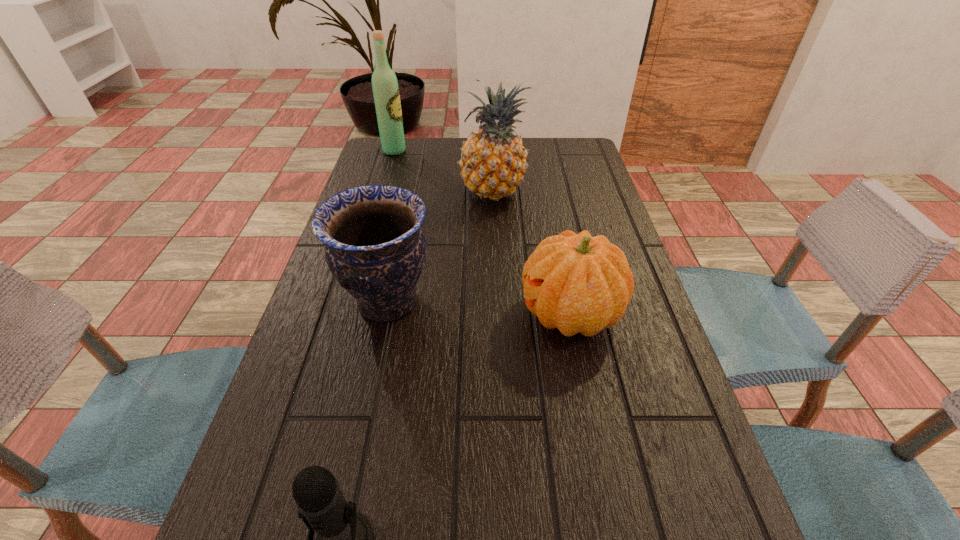
You are a GUI agent. You are given a task and a screenshot of the screen. Output one action in this format:
    pyautogui.click(x=<x>, y=<y>)
    Task: Click on the free spot located on the carved face of the pumpkin
    
    Given the screenshot: What is the action you would take?
    pyautogui.click(x=370, y=313)

Where is `object at the far edge`? This screenshot has height=540, width=960. object at the far edge is located at coordinates (385, 87).

You are a GUI agent. You are given a task and a screenshot of the screen. Output one action in this format:
    pyautogui.click(x=<x>, y=<y>)
    Task: Click on the wine bottle that is at the left edge
    The height and width of the screenshot is (540, 960).
    Given the screenshot: What is the action you would take?
    pyautogui.click(x=385, y=87)

The height and width of the screenshot is (540, 960). Identify the location of pottery located in the left edge section of the desktop. (375, 248).

At what (x,y) coordinates should I click in order to perform the action: click on object located in the right edge section of the desktop. Please return your answer as a coordinate pair (x, y). Looking at the image, I should click on (574, 282).

Image resolution: width=960 pixels, height=540 pixels. Find the location of `object that is at the far left corner`. object that is at the far left corner is located at coordinates (385, 87).

You are a GUI agent. You are given a task and a screenshot of the screen. Output one action in this format:
    pyautogui.click(x=<x>, y=<y>)
    Task: Click on the free region at the far edge
    The width and height of the screenshot is (960, 540).
    Given the screenshot: What is the action you would take?
    tap(535, 171)

Where is `free region at the left edge of the desktop`? This screenshot has height=540, width=960. free region at the left edge of the desktop is located at coordinates (367, 336).

Find the location of a particular element. vacant area at the right edge is located at coordinates (637, 303).

Locate an element on the screen. Image resolution: width=960 pixels, height=540 pixels. free space at the far right corner of the desktop is located at coordinates (549, 143).